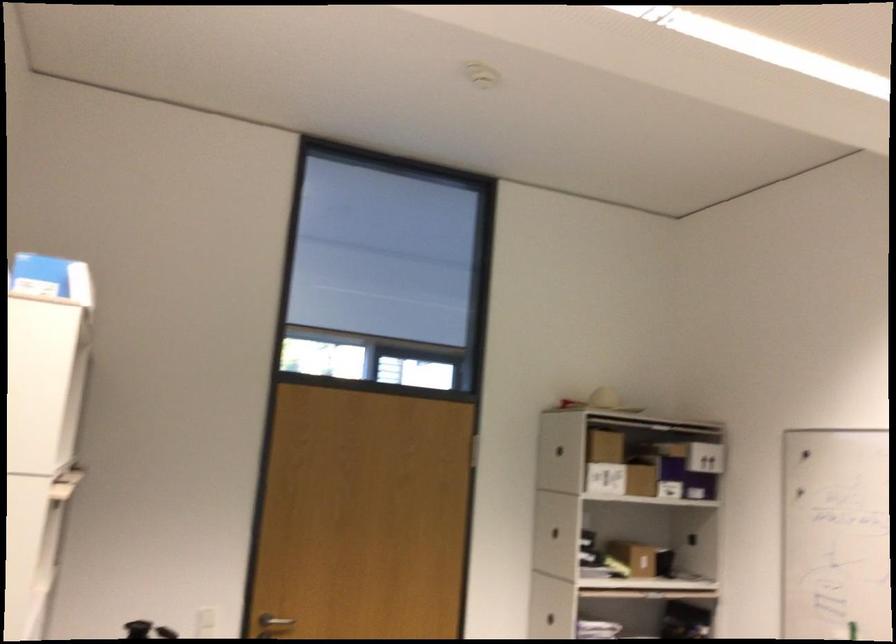
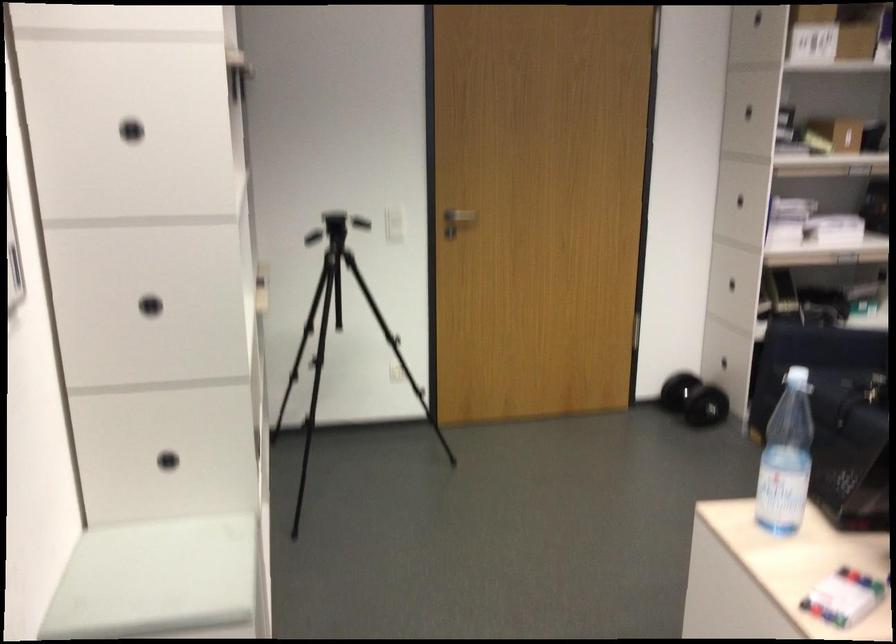
Where in the second image is the point corresponding to the point at 554,533 from the first image?

(747, 111)